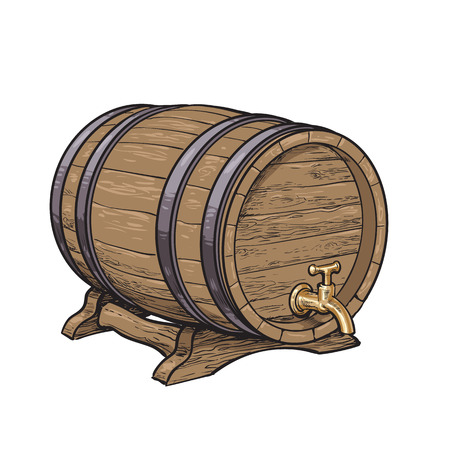
You are a GUI agent. You are given a task and a screenshot of the screen. Output one action in this format:
    pyautogui.click(x=<x>, y=<y>)
    Task: Click on the tap
    The image size is (450, 450).
    Given the screenshot: What is the action you would take?
    pyautogui.click(x=346, y=325)